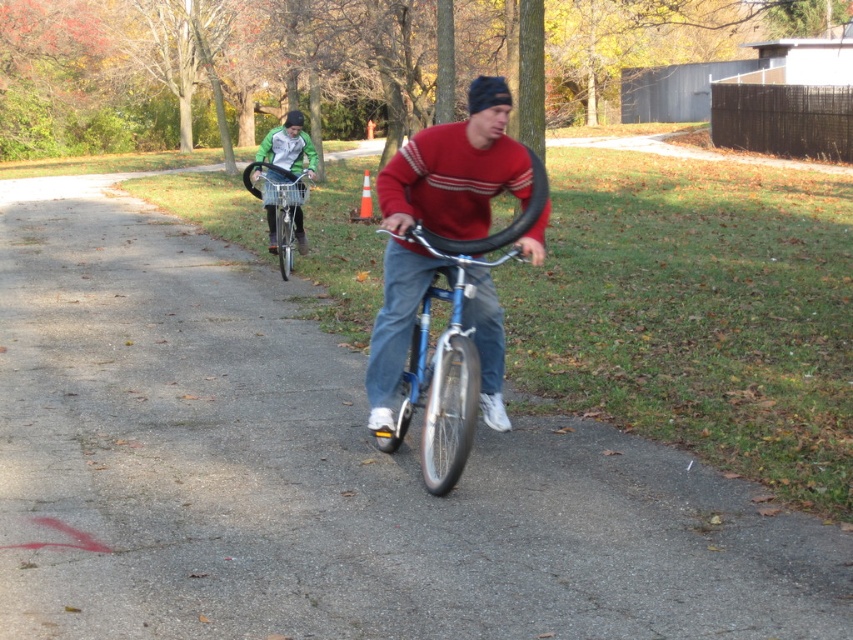
Question: Is matte red sweater at center smaller than matte black bicycle at center?

Choices:
 (A) no
 (B) yes

Answer: (B)

Question: Which object appears farthest from the camera in this image?

Choices:
 (A) matte red sweater at center
 (B) matte black bicycle at center
 (C) blue metallic bicycle at center

Answer: (B)

Question: Which point is farther from the camera taking this photo?

Choices:
 (A) (401, 154)
 (B) (285, 218)
 (C) (297, 172)
 (D) (659, 490)

Answer: (C)

Question: Can you confirm if matte black bicycle at center is positioned to the right of silver metallic bicycle at center?

Choices:
 (A) no
 (B) yes

Answer: (A)

Question: In this image, where is blue metallic bicycle at center located relative to silver metallic bicycle at center?

Choices:
 (A) below
 (B) above

Answer: (A)

Question: Considering the real-world distances, which object is closest to the blue metallic bicycle at center?

Choices:
 (A) matte red sweater at center
 (B) silver metallic bicycle at center

Answer: (A)